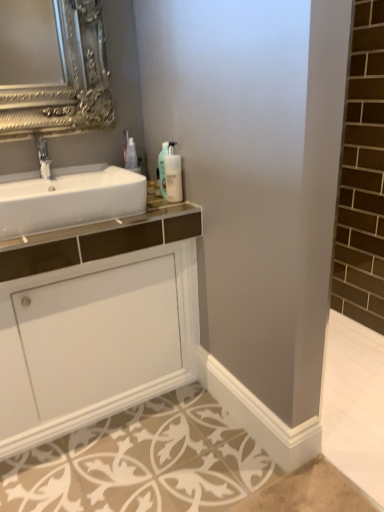
I want to click on vacant space situated on the left part of white painted wood baseboard at lower center, so click(165, 433).